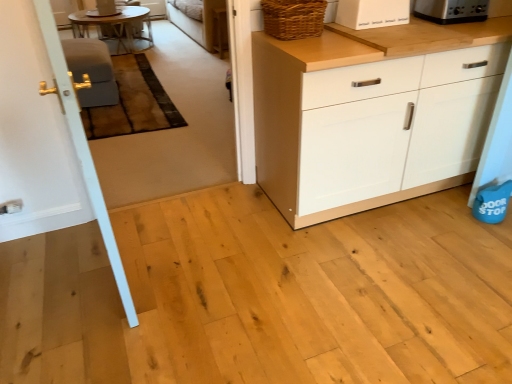
You are a GUI agent. You are given a task and a screenshot of the screen. Output one action in this format:
    pyautogui.click(x=<x>, y=<y>)
    Task: Click on the free location in front of white painted wood door at left
    
    Given the screenshot: What is the action you would take?
    pyautogui.click(x=95, y=326)